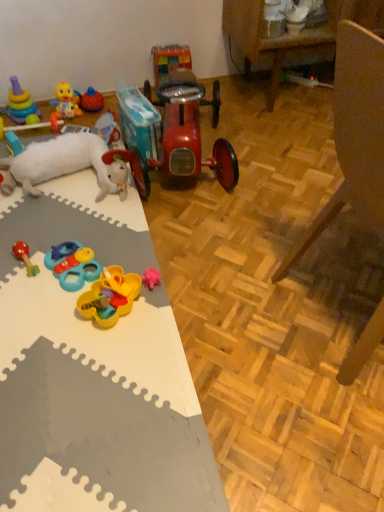
Locate an element on the screen. The width and height of the screenshot is (384, 512). free space that is in between wooden armchair at lower right and shiny red car at center, which is the first toy in right-to-left order is located at coordinates (253, 216).